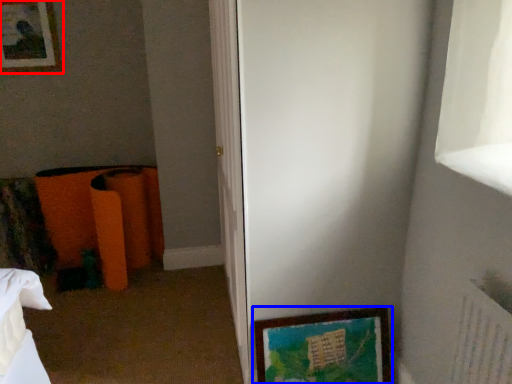
Question: Which point is further to the camera, picture frame (highlighted by a red box) or picture frame (highlighted by a blue box)?

Choices:
 (A) picture frame
 (B) picture frame

Answer: (A)